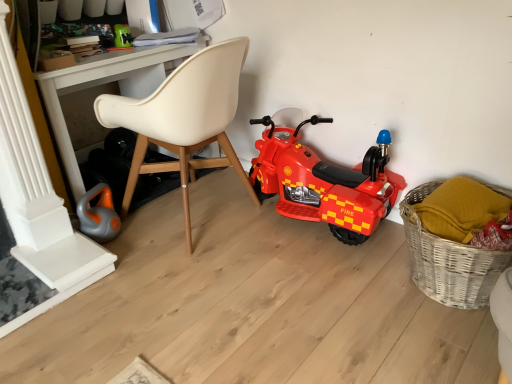
Find the location of a particular element. free space to the back side of orange rubber toy at lower left, arranged as the 2th toy when viewed from the back is located at coordinates (137, 213).